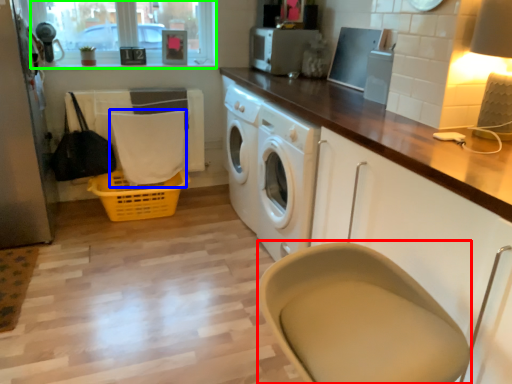
Question: Based on their relative distances, which object is farther from feeding chair (highlighted by a red box)? Choose from clothe (highlighted by a blue box) and window screen (highlighted by a green box).

Choices:
 (A) clothe
 (B) window screen

Answer: (B)